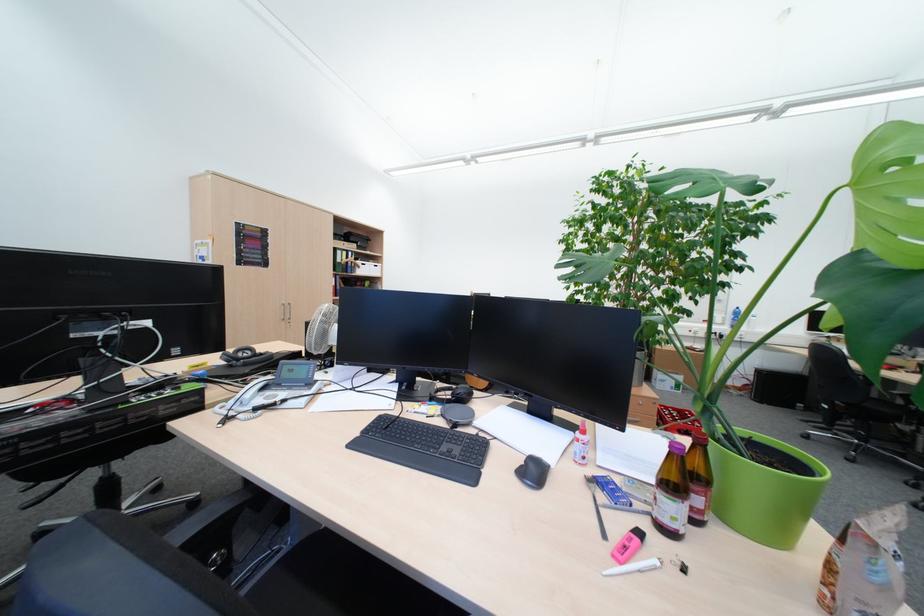
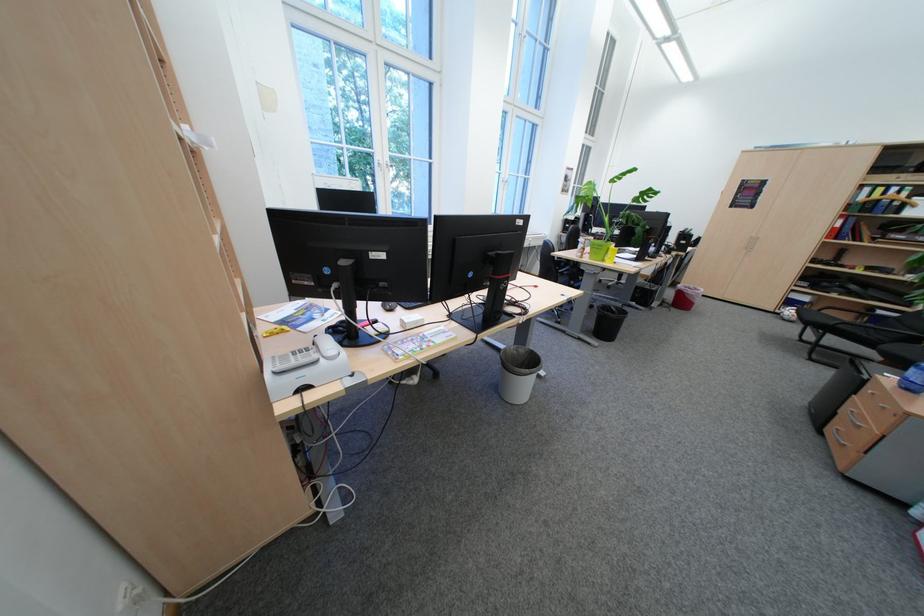
Find the pixel in the second image that matches [357,254] in the first image.

(893, 190)